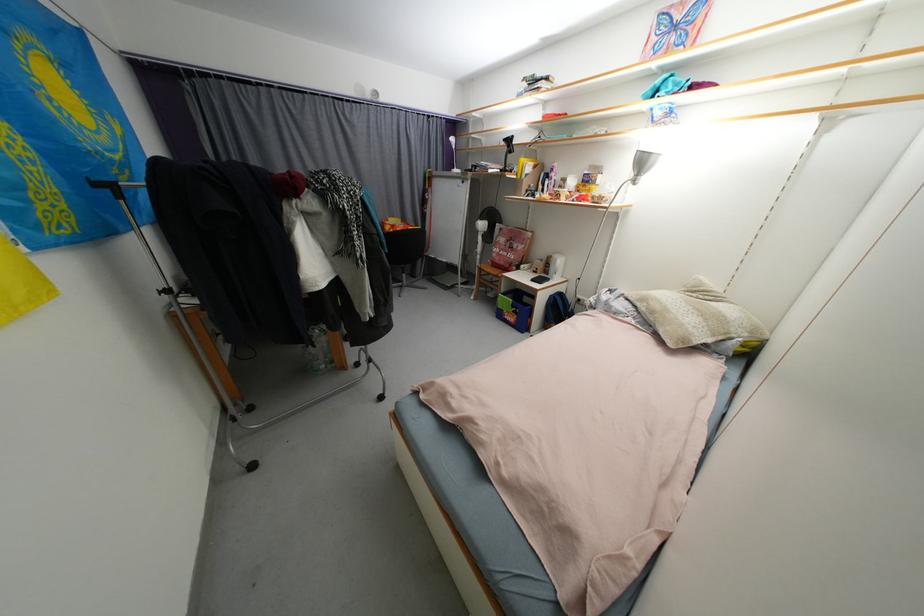
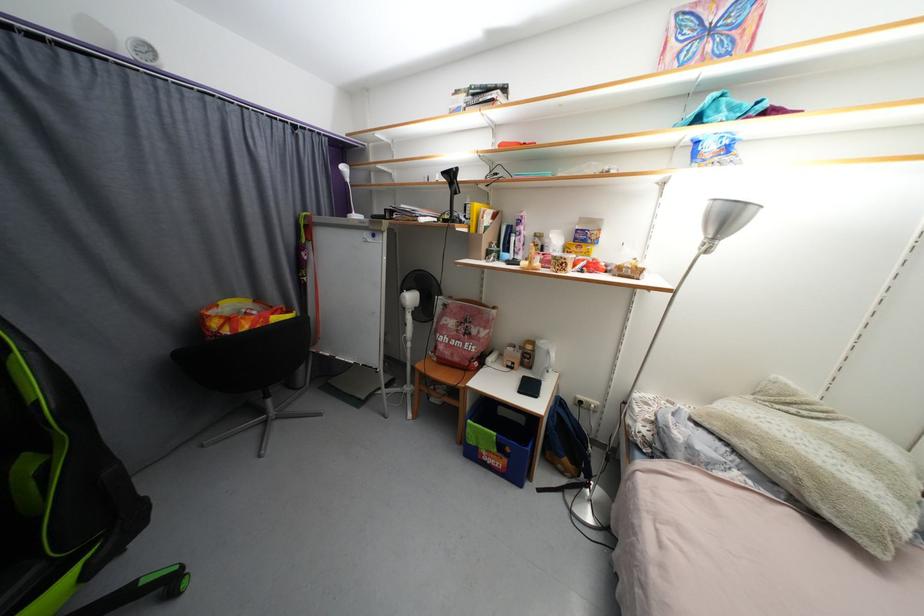
Find the pixel in the second image that matches [460,172] in the first image.

(360, 217)